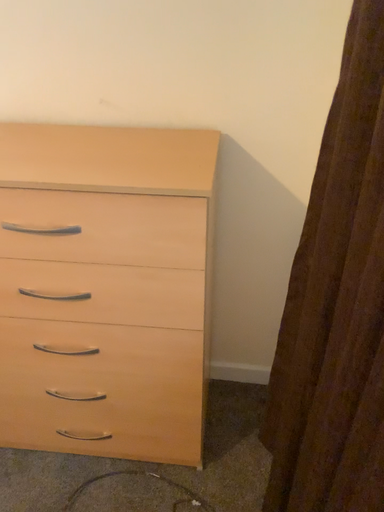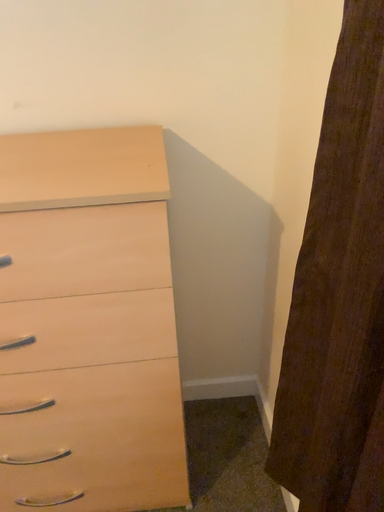
Question: How did the camera likely rotate when shooting the video?

Choices:
 (A) rotated right
 (B) rotated left

Answer: (A)